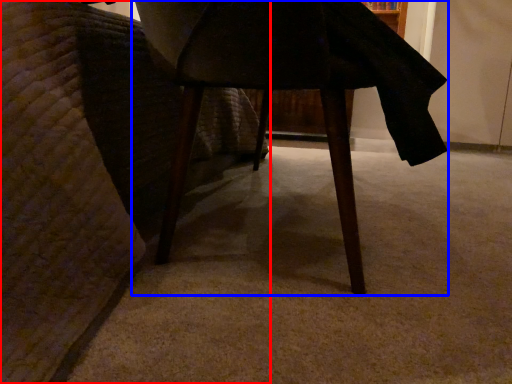
Question: Which point is further to the camera, furniture (highlighted by a red box) or table (highlighted by a blue box)?

Choices:
 (A) furniture
 (B) table

Answer: (B)